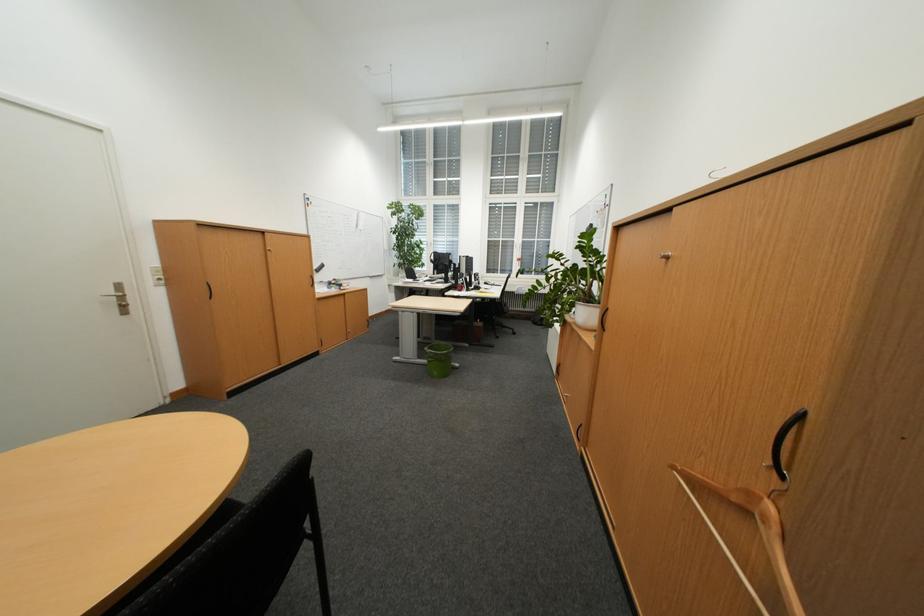
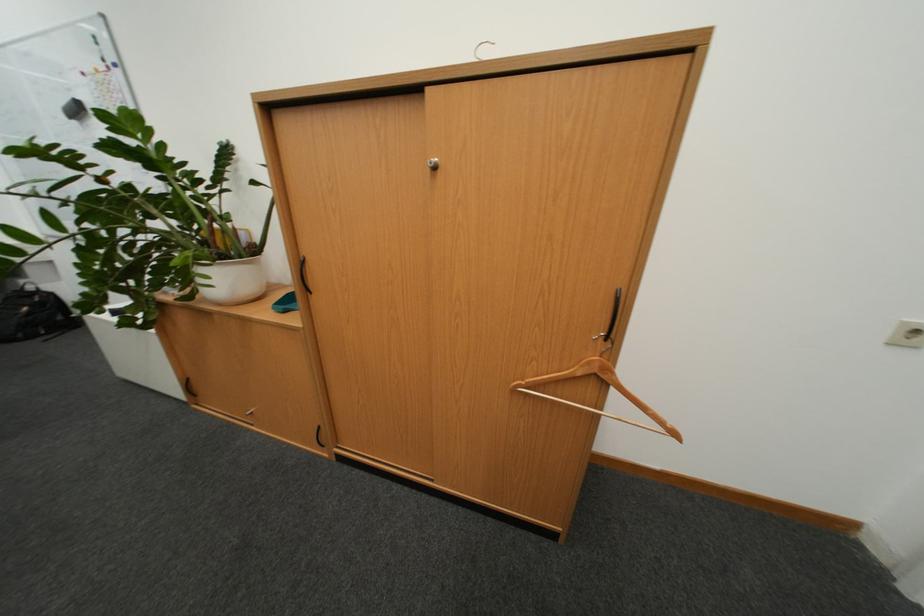
The first image is from the beginning of the video and the second image is from the end. How did the camera likely rotate when shooting the video?

The camera's rotation is toward right-down.